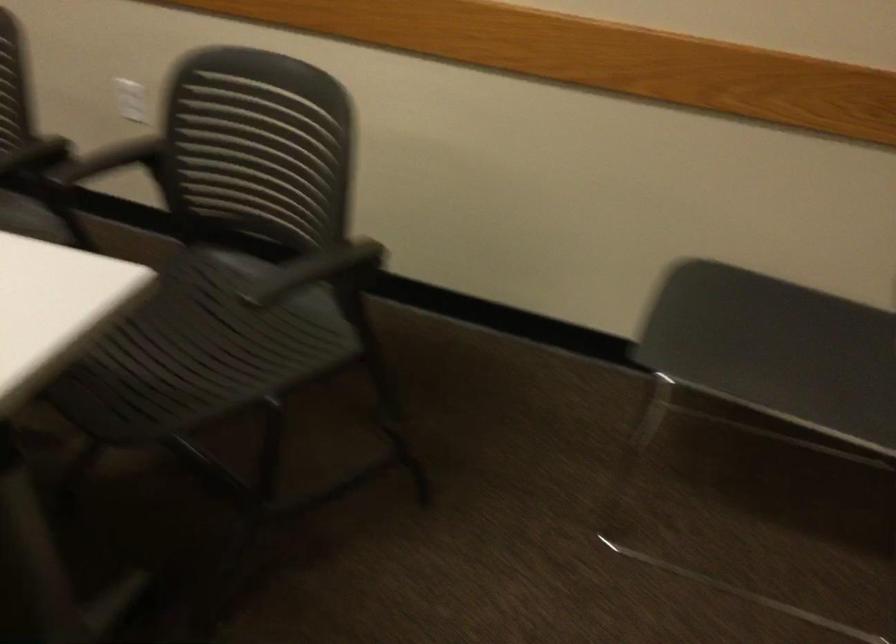
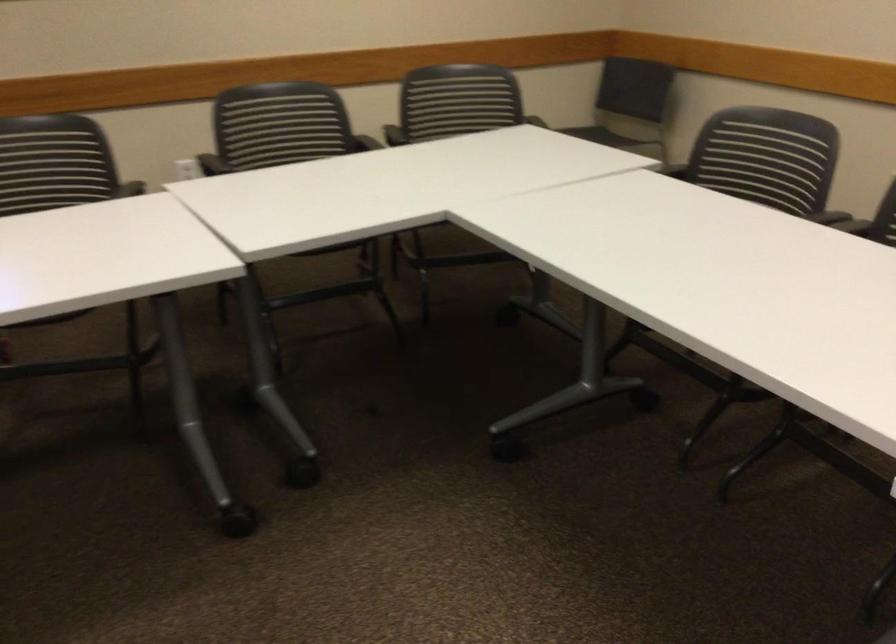
The point at [320,147] is marked in the first image. Where is the corresponding point in the second image?

(455, 100)